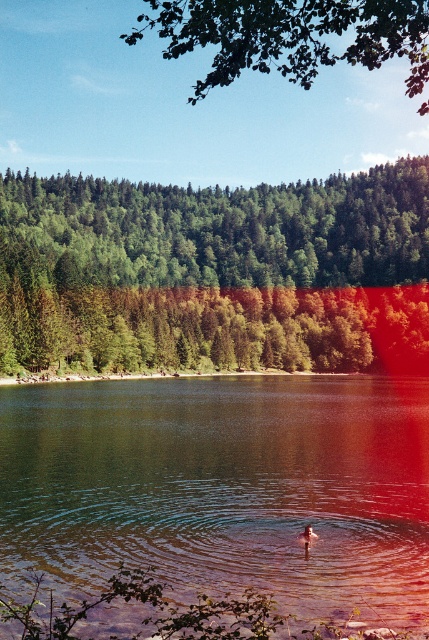
Question: Based on their relative distances, which object is farther from the green matte tree at center?

Choices:
 (A) green leafy tree at upper center
 (B) clear water at center

Answer: (B)

Question: Is clear water at center closer to camera compared to green matte tree at center?

Choices:
 (A) no
 (B) yes

Answer: (B)

Question: Which of these objects is positioned closest to the green matte tree at center?

Choices:
 (A) clear water at center
 (B) green leafy tree at upper center

Answer: (B)

Question: Which object is the closest to the green matte tree at center?

Choices:
 (A) green leafy tree at upper center
 (B) clear water at center

Answer: (A)

Question: Can you confirm if green matte tree at center is positioned to the right of green leafy tree at upper center?

Choices:
 (A) yes
 (B) no

Answer: (B)

Question: Is clear water at center further to camera compared to green matte tree at center?

Choices:
 (A) yes
 (B) no

Answer: (B)